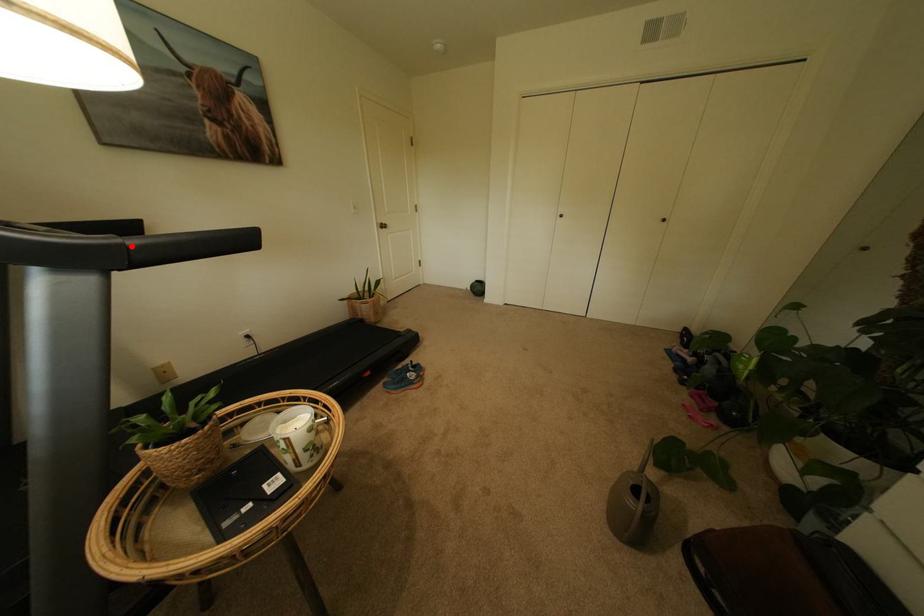
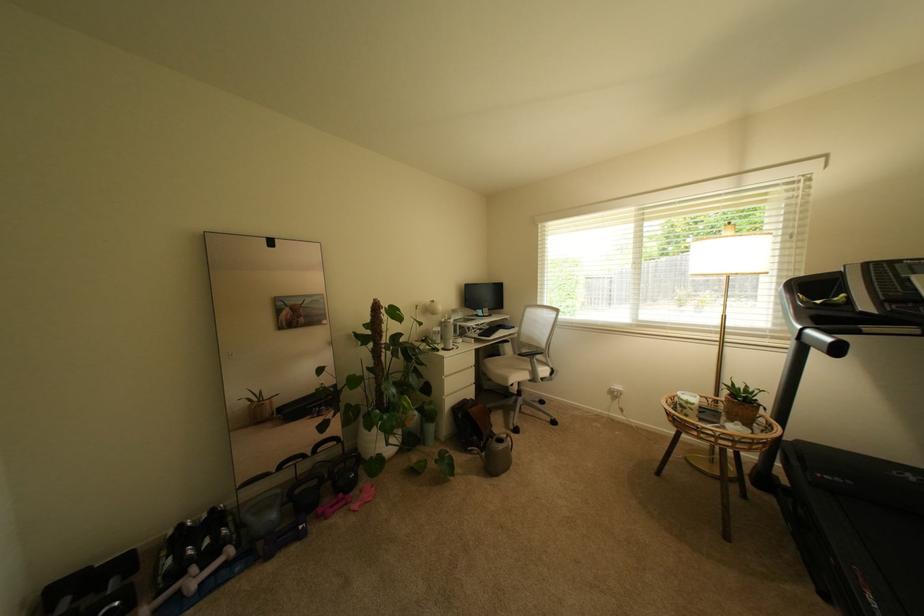
Question: I am providing you with two images of the same scene from different viewpoints. A red point is marked on the first image. At the location where the point appears in image 1, is it still visible in image 2?

Choices:
 (A) Yes
 (B) No

Answer: (A)